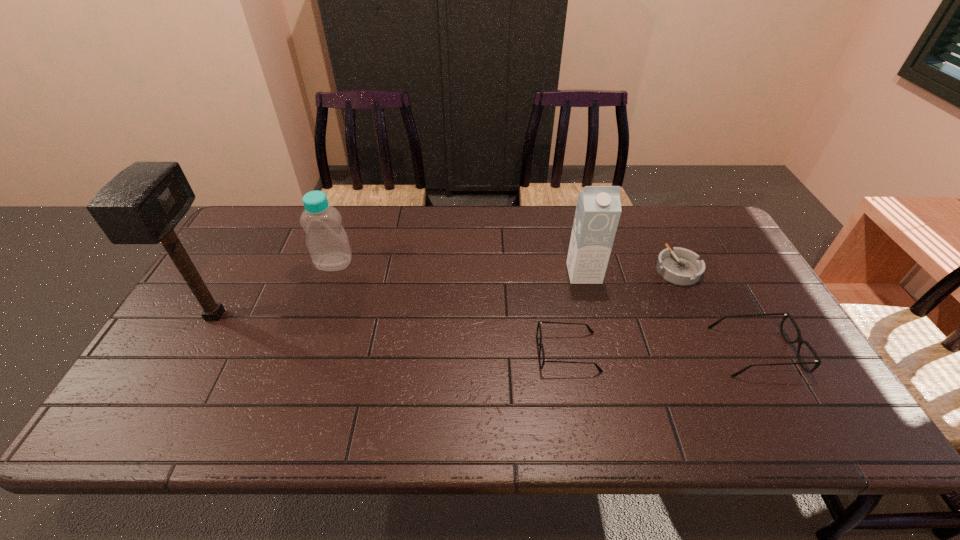
Locate an element on the screen. The height and width of the screenshot is (540, 960). free space located with the lenses facing outward on the right spectacles is located at coordinates (678, 352).

I want to click on vacant space situated with the lenses facing outward on the right spectacles, so tap(646, 352).

At what (x,y) coordinates should I click in order to perform the action: click on vacant space located 0.060m with the lenses facing outward on the right spectacles. Please return your answer as a coordinate pair (x, y). The width and height of the screenshot is (960, 540). Looking at the image, I should click on (694, 352).

At what (x,y) coordinates should I click in order to perform the action: click on vacant space situated 0.180m on the right of the tallest object. Please return your answer as a coordinate pair (x, y). Image resolution: width=960 pixels, height=540 pixels. Looking at the image, I should click on (301, 315).

Locate an element on the screen. Image resolution: width=960 pixels, height=540 pixels. vacant space positioned 0.380m on the right of the fifth object from right to left is located at coordinates (478, 262).

The width and height of the screenshot is (960, 540). I want to click on blank area located on the front label of the second tallest object, so click(x=589, y=297).

In order to click on blank area located on the left of the shortest object in this screenshot , I will do `click(636, 269)`.

At what (x,y) coordinates should I click in order to perform the action: click on object that is at the left edge. Please return your answer as a coordinate pair (x, y). Image resolution: width=960 pixels, height=540 pixels. Looking at the image, I should click on (142, 204).

At what (x,y) coordinates should I click in order to perform the action: click on spectacles present at the right edge. Please return your answer as a coordinate pair (x, y). This screenshot has height=540, width=960. Looking at the image, I should click on (799, 339).

At what (x,y) coordinates should I click in order to perform the action: click on ashtray present at the right edge. Please return your answer as a coordinate pair (x, y). Looking at the image, I should click on (680, 266).